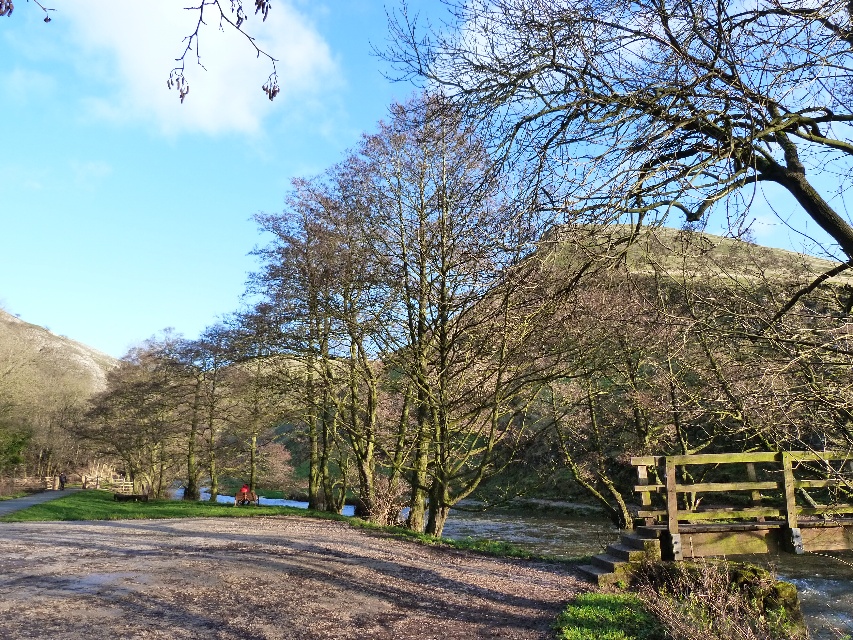
Question: Does damp gravel path at lower center have a larger size compared to brown gravel path at lower left?

Choices:
 (A) no
 (B) yes

Answer: (B)

Question: In this image, where is damp gravel path at lower center located relative to brown gravel path at lower left?

Choices:
 (A) below
 (B) above

Answer: (B)

Question: Which point is closer to the camera taking this photo?

Choices:
 (A) (680, 532)
 (B) (33, 497)

Answer: (A)

Question: Which point appears farthest from the camera in this image?

Choices:
 (A) (796, 483)
 (B) (67, 488)
 (C) (166, 536)

Answer: (B)

Question: Which object is the farthest from the brown gravel path at lower left?

Choices:
 (A) green mossy wood bridge at lower right
 (B) damp gravel path at lower center

Answer: (A)

Question: Is green mossy wood bridge at lower right bigger than brown gravel path at lower left?

Choices:
 (A) yes
 (B) no

Answer: (A)